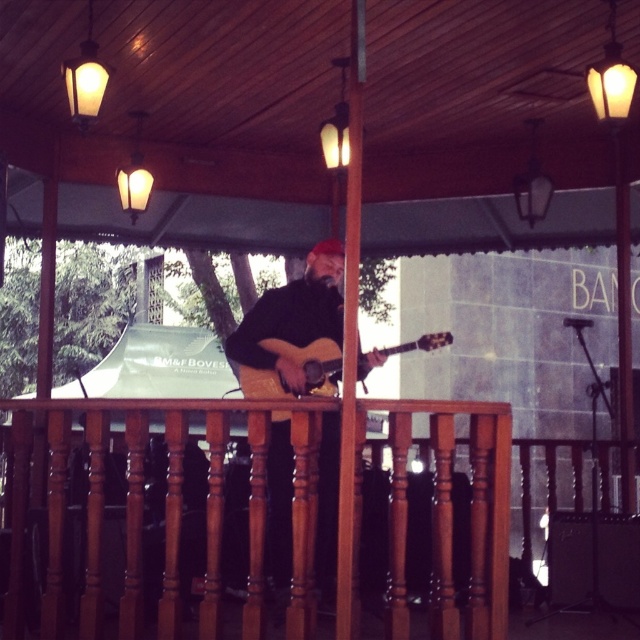
Question: Is brown polished wood railing at center thinner than acoustic wood guitar at center?

Choices:
 (A) yes
 (B) no

Answer: (B)

Question: Is brown polished wood railing at center thinner than acoustic wood guitar at center?

Choices:
 (A) yes
 (B) no

Answer: (B)

Question: Observing the image, what is the correct spatial positioning of brown polished wood railing at center in reference to matte brown guitar at center?

Choices:
 (A) left
 (B) right

Answer: (A)

Question: Among these points, which one is farthest from the camera?

Choices:
 (A) (397, 472)
 (B) (259, 333)
 (C) (428, 344)

Answer: (B)

Question: Which point is closer to the camera taking this photo?

Choices:
 (A) (202, 632)
 (B) (316, 269)

Answer: (A)

Question: Which of the following is the closest to the observer?

Choices:
 (A) matte brown guitar at center
 (B) acoustic wood guitar at center

Answer: (B)